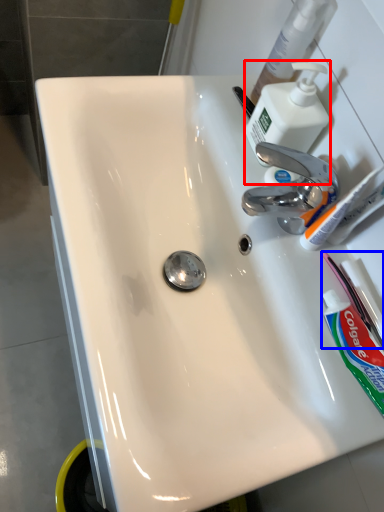
Question: Which point is closer to the camera, soap dispenser (highlighted by a red box) or toothbrush (highlighted by a blue box)?

Choices:
 (A) soap dispenser
 (B) toothbrush

Answer: (B)